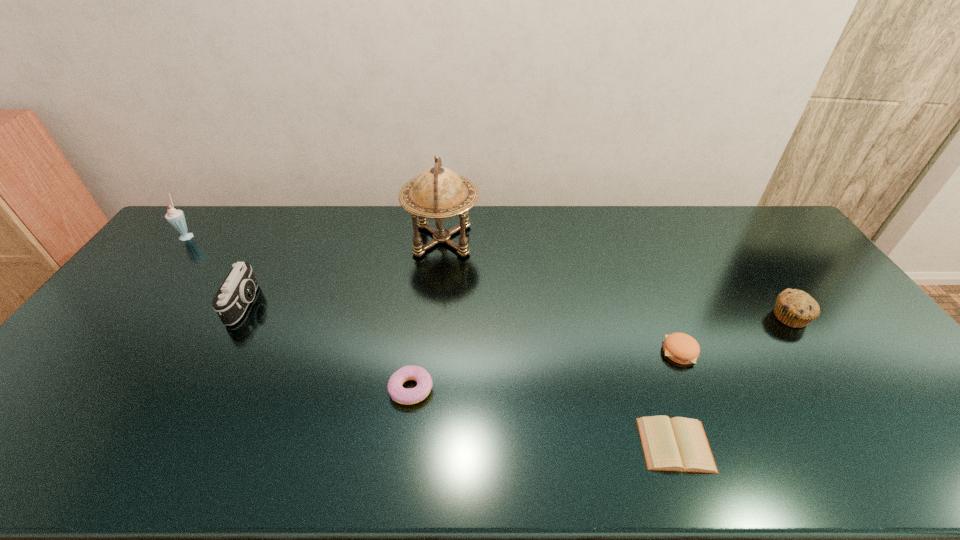
You are a GUI agent. You are given a task and a screenshot of the screen. Output one action in this format:
    pyautogui.click(x=<x>, y=<y>)
    Task: Click on the diary
    Image resolution: width=960 pixels, height=540 pixels.
    Given the screenshot: What is the action you would take?
    pyautogui.click(x=680, y=444)

Find the location of `vacant area situated 0.230m on the front-facing side of the globe`. vacant area situated 0.230m on the front-facing side of the globe is located at coordinates (544, 240).

Image resolution: width=960 pixels, height=540 pixels. I want to click on vacant space situated 0.350m on the straw side of the leftmost object, so click(294, 235).

Where is `free region located on the front lens of the sixth object from right to left`? free region located on the front lens of the sixth object from right to left is located at coordinates (351, 304).

At what (x,y) coordinates should I click in order to perform the action: click on vacant space positioned 0.230m on the back of the fourth shortest object. Please return your answer as a coordinate pair (x, y). Image resolution: width=960 pixels, height=540 pixels. Looking at the image, I should click on (747, 254).

You are a GUI agent. You are given a task and a screenshot of the screen. Output one action in this format:
    pyautogui.click(x=<x>, y=<y>)
    Task: Click on the free location located 0.330m on the back of the fifth farthest object
    The image size is (960, 540).
    Given the screenshot: What is the action you would take?
    pyautogui.click(x=642, y=261)

At what (x,y) coordinates should I click in order to perform the action: click on vacant space situated 0.330m on the right of the doughnut. Please return your answer as a coordinate pair (x, y). This screenshot has width=960, height=540. Looking at the image, I should click on [x=564, y=389].

The image size is (960, 540). What are the coordinates of `vacant position located on the back of the shortest object` in the screenshot? It's located at (636, 326).

At what (x,y) coordinates should I click in order to perform the action: click on globe present at the far edge. Please return your answer as a coordinate pair (x, y). Image resolution: width=960 pixels, height=540 pixels. Looking at the image, I should click on (438, 193).

Where is `milkshake at the far edge`? milkshake at the far edge is located at coordinates (176, 218).